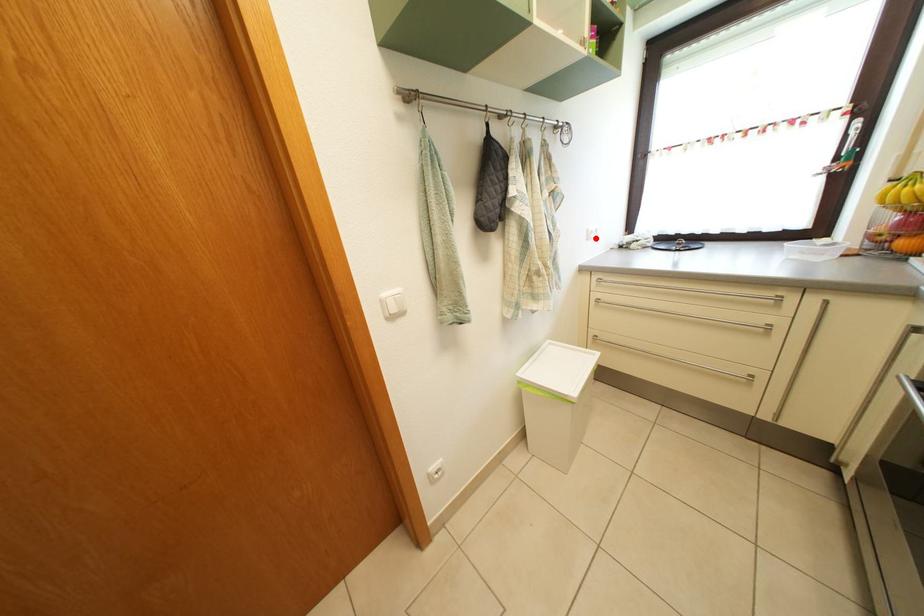
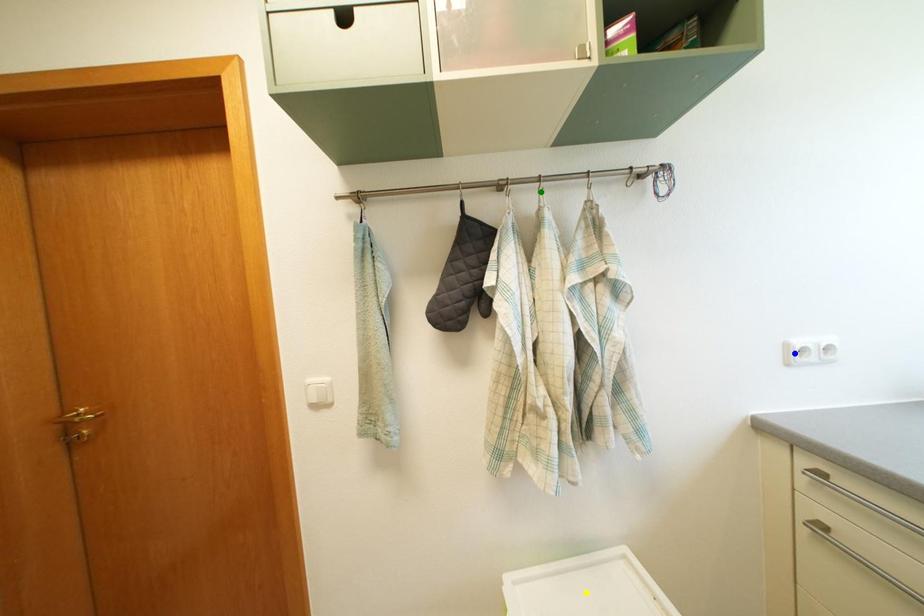
Question: I am providing you with two images of the same scene from different viewpoints. A red point is marked on the first image. You are given multiple points on the second image. Which point in image 2 represents the same 3d spot as the red point in image 1?

Choices:
 (A) green point
 (B) yellow point
 (C) blue point

Answer: (C)